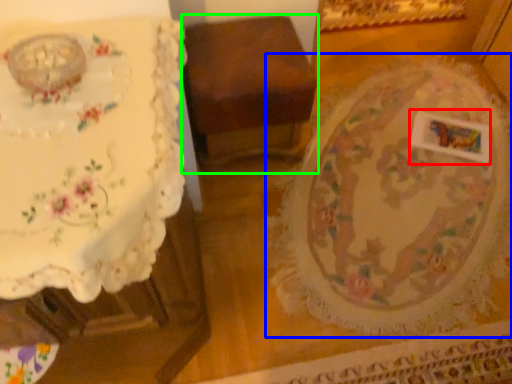
Question: Which object is the closest to the square (highlighted by a red box)? Choose among these: round table (highlighted by a blue box) or furniture (highlighted by a green box).

Choices:
 (A) round table
 (B) furniture

Answer: (A)